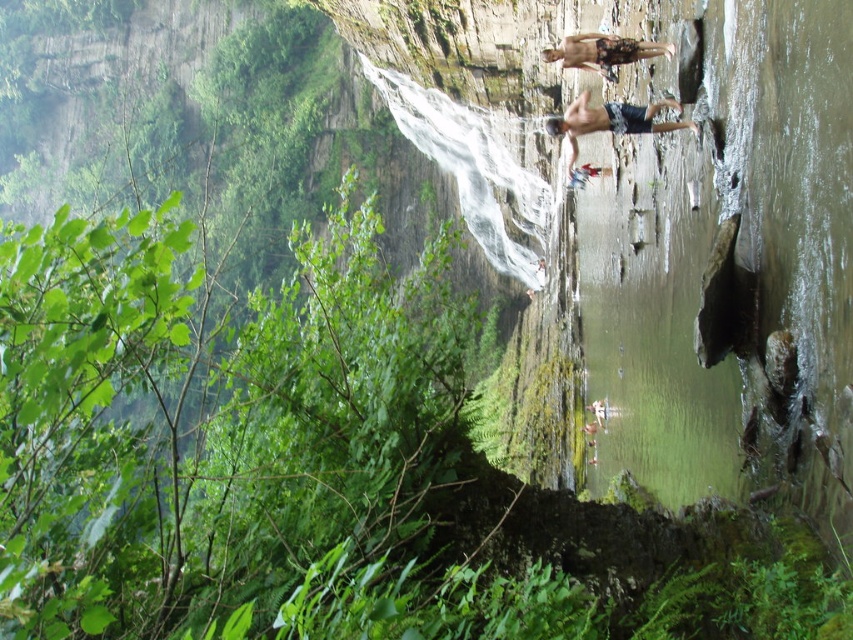
Question: Which point is farther to the camera?

Choices:
 (A) smooth skin rock climber at upper right
 (B) camouflage shorts at upper center

Answer: (B)

Question: Is smooth skin rock climber at upper right wider than camouflage shorts at upper center?

Choices:
 (A) yes
 (B) no

Answer: (A)

Question: Can you confirm if smooth skin rock climber at upper right is thinner than camouflage shorts at upper center?

Choices:
 (A) yes
 (B) no

Answer: (B)

Question: Does smooth skin rock climber at upper right have a lesser width compared to camouflage shorts at upper center?

Choices:
 (A) no
 (B) yes

Answer: (A)